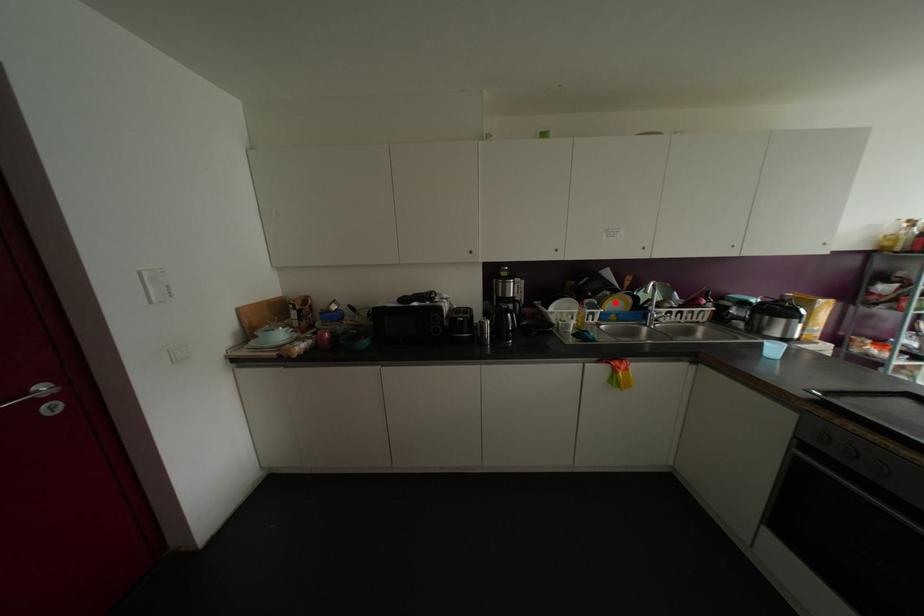
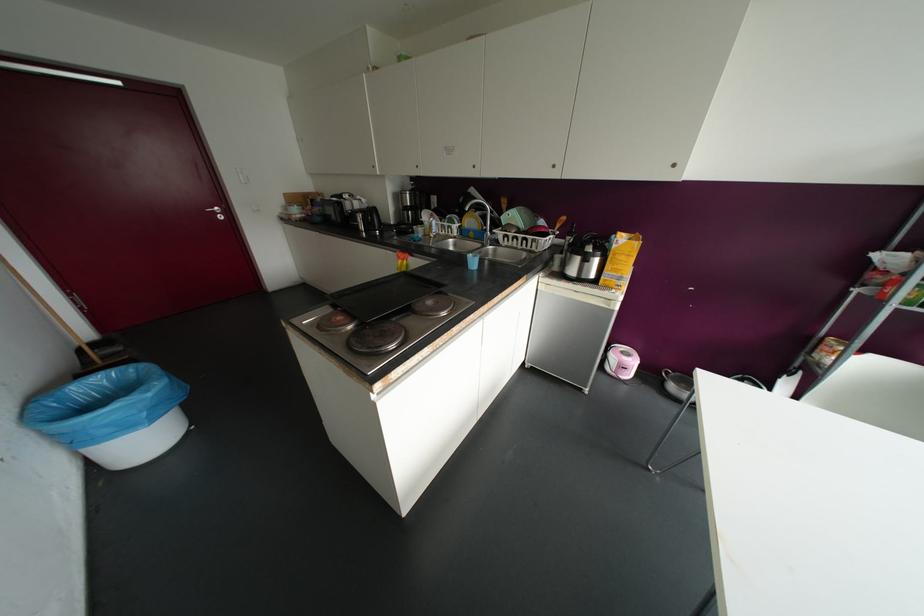
Question: I am providing you with two images of the same scene from different viewpoints. Image1 has a red point marked. In image2, the corresponding 3D location appears at what relative position? Reply with the corresponding letter.

Choices:
 (A) Closer
 (B) Farther

Answer: (A)